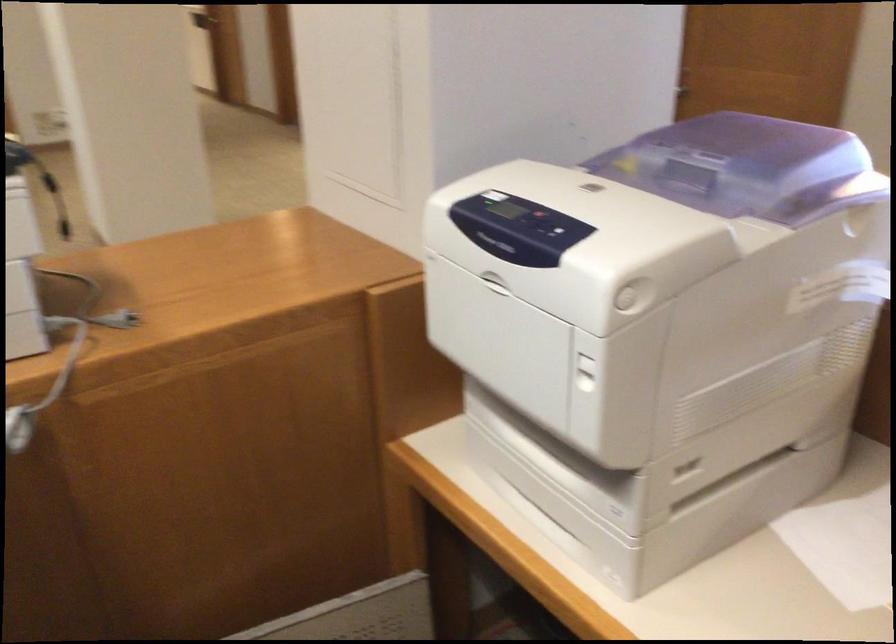
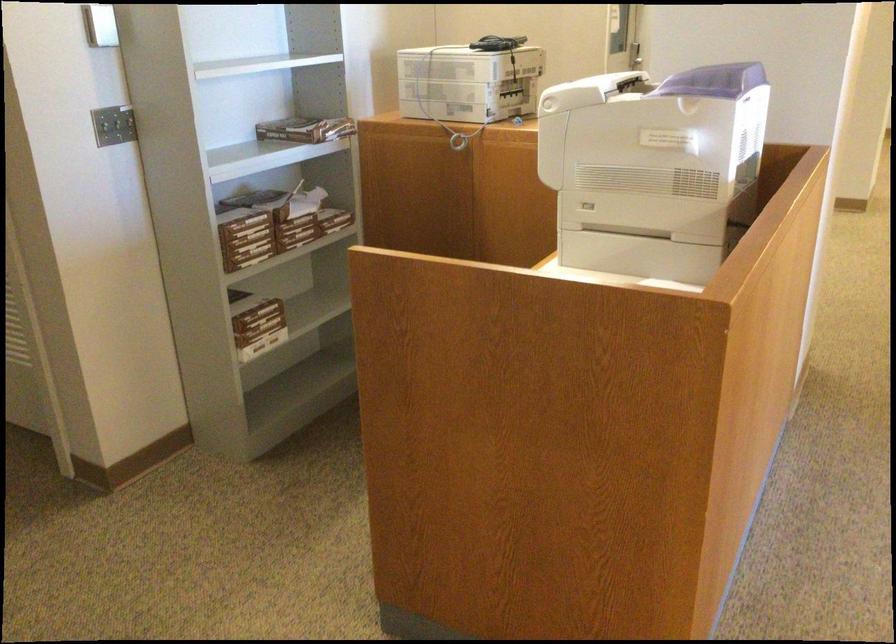
The point at (773, 525) is marked in the first image. Where is the corresponding point in the second image?

(640, 254)